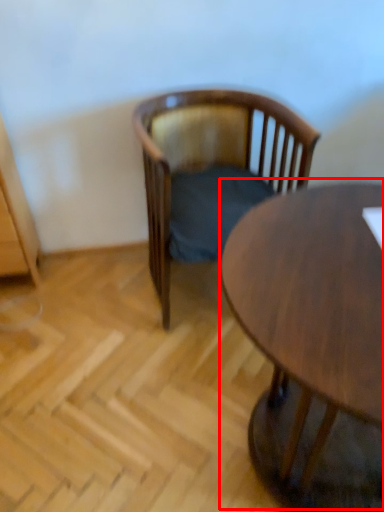
Question: From the image, what is the correct spatial relationship of coffee table (annotated by the red box) in relation to chair?

Choices:
 (A) right
 (B) left

Answer: (A)